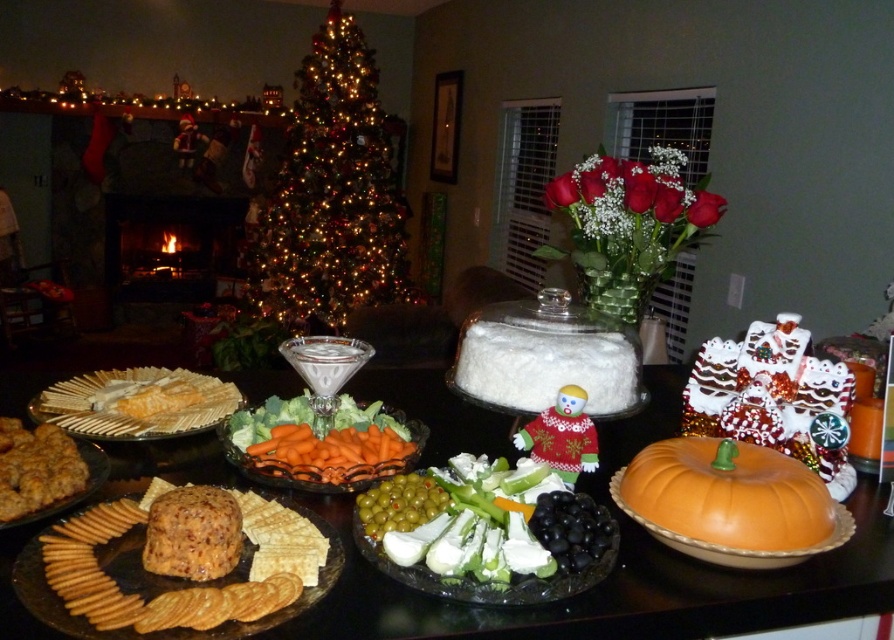
Who is taller, green artificial christmas tree at center or white cracker at center-left?

Standing taller between the two is green artificial christmas tree at center.

Does green artificial christmas tree at center appear on the left side of white cracker at center-left?

Correct, you'll find green artificial christmas tree at center to the left of white cracker at center-left.

Describe the element at coordinates (332, 193) in the screenshot. Image resolution: width=894 pixels, height=640 pixels. I see `green artificial christmas tree at center` at that location.

Where is `green artificial christmas tree at center`? The width and height of the screenshot is (894, 640). green artificial christmas tree at center is located at coordinates (332, 193).

Which is more to the left, green artificial christmas tree at center or green glossy olives at center?

green artificial christmas tree at center

Measure the distance between point (369,104) and camera.

4.53 meters

Locate an element on the screen. The image size is (894, 640). green artificial christmas tree at center is located at coordinates (332, 193).

Where is `green artificial christmas tree at center`? green artificial christmas tree at center is located at coordinates (332, 193).

Who is higher up, green artificial christmas tree at center or orange glossy pumpkin at lower right?

green artificial christmas tree at center is above.

Is point (330, 129) less distant than point (752, 451)?

No, it is behind (752, 451).

Who is more forward, (331, 140) or (825, 496)?

Positioned in front is point (825, 496).

I want to click on green artificial christmas tree at center, so click(x=332, y=193).